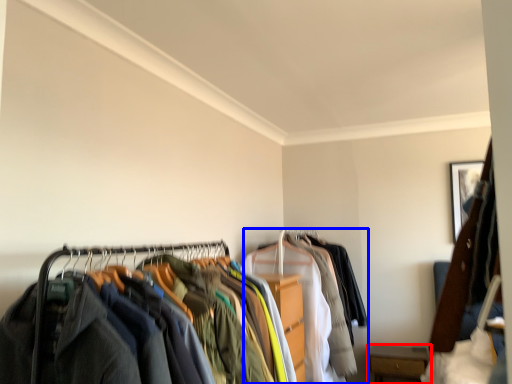
Question: Which object appears closest to the camera in this image, furniture (highlighted by a red box) or garment (highlighted by a blue box)?

Choices:
 (A) furniture
 (B) garment

Answer: (B)